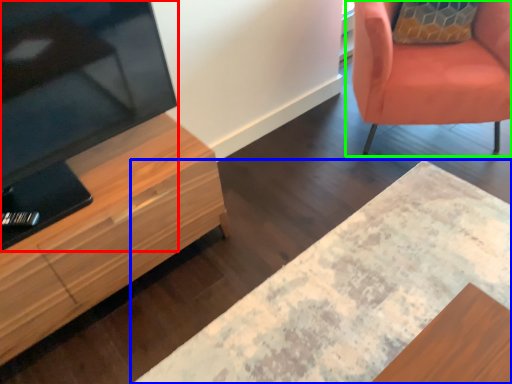
Question: Which object is positioned farthest from television (highlighted by a red box)? Select from desk (highlighted by a blue box) and chair (highlighted by a green box).

Choices:
 (A) desk
 (B) chair

Answer: (B)